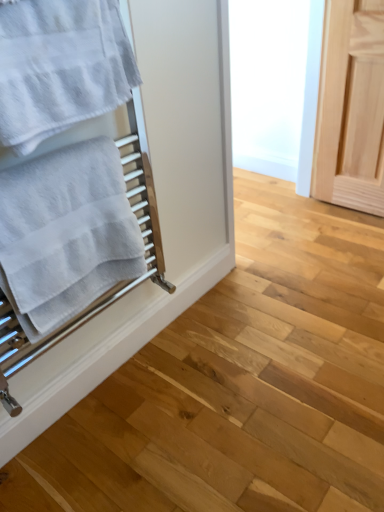
Identify the location of vacant space in white cotton towel at left, which is the 2th towel from top to bottom (from a real-world perspective). (111, 395).